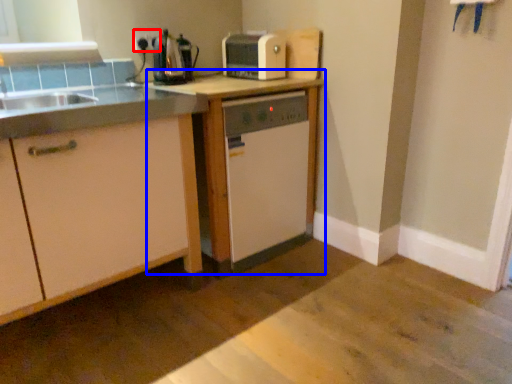
Question: Which of the following is the farthest to the observer, electric outlet (highlighted by a red box) or table (highlighted by a blue box)?

Choices:
 (A) electric outlet
 (B) table

Answer: (A)